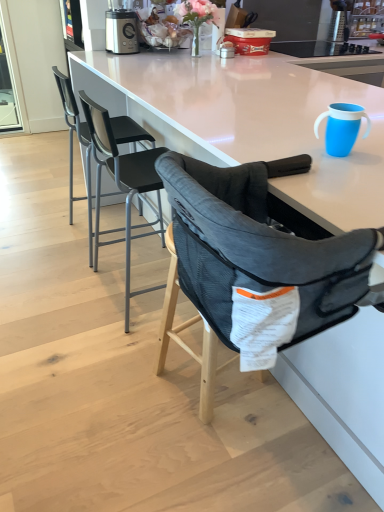
Question: Is blue plastic cup at upper right positioned with its back to black mesh chair at center, which is counted as the second chair, starting from the front?

Choices:
 (A) no
 (B) yes

Answer: (A)

Question: Does blue plastic cup at upper right touch black mesh chair at center, the second chair in the back-to-front sequence?

Choices:
 (A) no
 (B) yes

Answer: (A)

Question: Is blue plastic cup at upper right surrounding black mesh chair at center, which is counted as the second chair, starting from the front?

Choices:
 (A) no
 (B) yes

Answer: (A)

Question: Considering the relative sizes of blue plastic cup at upper right and black mesh chair at center, the second chair in the back-to-front sequence, in the image provided, is blue plastic cup at upper right bigger than black mesh chair at center, the second chair in the back-to-front sequence,?

Choices:
 (A) no
 (B) yes

Answer: (A)

Question: From a real-world perspective, is blue plastic cup at upper right positioned under black mesh chair at center, the second chair in the back-to-front sequence, based on gravity?

Choices:
 (A) yes
 (B) no

Answer: (B)

Question: Considering the relative positions of metallic silver blender at upper center and black mesh chair at center, which is counted as the second chair, starting from the front, in the image provided, is metallic silver blender at upper center to the left or to the right of black mesh chair at center, which is counted as the second chair, starting from the front,?

Choices:
 (A) left
 (B) right

Answer: (A)

Question: Looking at the image, does metallic silver blender at upper center seem bigger or smaller compared to black mesh chair at center, which is counted as the second chair, starting from the front?

Choices:
 (A) big
 (B) small

Answer: (B)

Question: Is metallic silver blender at upper center in front of or behind black mesh chair at center, the second chair in the back-to-front sequence, in the image?

Choices:
 (A) behind
 (B) front

Answer: (A)

Question: From the image's perspective, relative to black mesh chair at center, which is counted as the second chair, starting from the front, is metallic silver blender at upper center above or below?

Choices:
 (A) above
 (B) below

Answer: (A)

Question: Is blue plastic cup at upper right in front of or behind metallic silver blender at upper center in the image?

Choices:
 (A) front
 (B) behind

Answer: (A)

Question: In terms of width, does blue plastic cup at upper right look wider or thinner when compared to metallic silver blender at upper center?

Choices:
 (A) wide
 (B) thin

Answer: (B)

Question: Is blue plastic cup at upper right taller or shorter than metallic silver blender at upper center?

Choices:
 (A) short
 (B) tall

Answer: (A)

Question: Considering the positions of blue plastic cup at upper right and metallic silver blender at upper center in the image, is blue plastic cup at upper right bigger or smaller than metallic silver blender at upper center?

Choices:
 (A) small
 (B) big

Answer: (A)

Question: In terms of size, does transparent glass screen door at upper left appear bigger or smaller than metallic silver blender at upper center?

Choices:
 (A) big
 (B) small

Answer: (A)

Question: In the image, is transparent glass screen door at upper left positioned in front of or behind metallic silver blender at upper center?

Choices:
 (A) behind
 (B) front

Answer: (A)